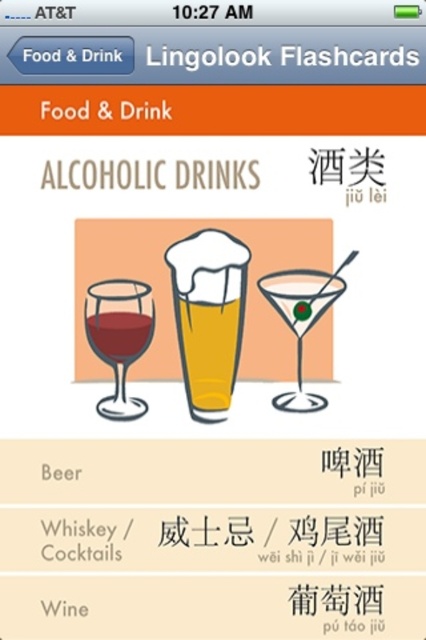
Question: Does translucent glass at center appear under matte glass at center?

Choices:
 (A) yes
 (B) no

Answer: (A)

Question: Which is nearer to the transparent glass martini at center?

Choices:
 (A) matte glass wine at left
 (B) foamy golden beer at center

Answer: (B)

Question: Does matte glass wine at left have a larger size compared to transparent glass martini at center?

Choices:
 (A) no
 (B) yes

Answer: (A)

Question: Which point appears farthest from the camera in this image?

Choices:
 (A) (183, 355)
 (B) (135, 346)
 (C) (293, 330)
 (D) (216, 310)

Answer: (A)

Question: Can you confirm if matte glass wine at left is smaller than translucent glass at center?

Choices:
 (A) no
 (B) yes

Answer: (A)

Question: Estimate the real-world distances between objects in this image. Which object is farther from the foamy golden beer at center?

Choices:
 (A) matte glass wine at left
 (B) matte glass at center
 (C) translucent glass at center
 (D) transparent glass martini at center

Answer: (B)